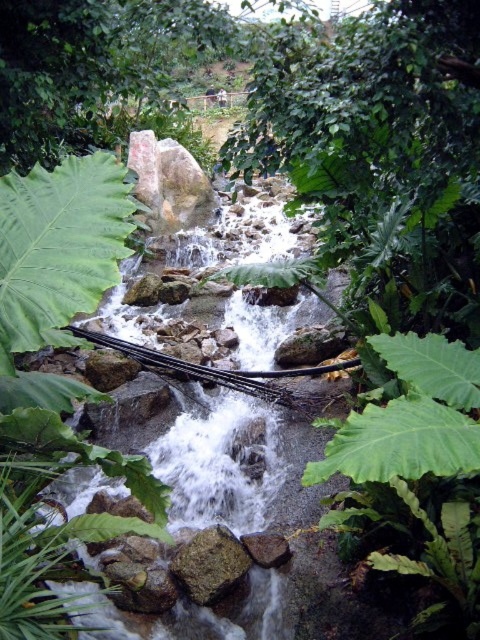
You are standing at the edge of the waterfall and want to reach the brown rough rock at center. However, there is a green leafy fern at center blocking your path. Can you step over the fern to reach the rock?

The green leafy fern at center is closer to the viewer than the brown rough rock at center, so you can step over the fern to reach the rock since it is in front of the rock.

You are standing at the edge of the waterfall and see the green leafy fern at center and the brown rough rock at center. Which object is closer to your left side?

The green leafy fern at center is to the left of the brown rough rock at center, so it is closer to your left side.